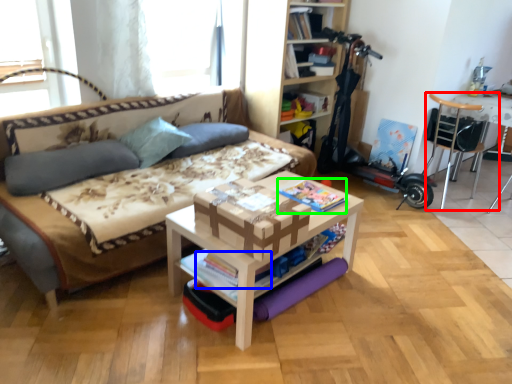
Question: Which object is the closest to the chair (highlighted by a red box)? Choose among these: magazine (highlighted by a blue box) or magazine (highlighted by a green box).

Choices:
 (A) magazine
 (B) magazine

Answer: (B)